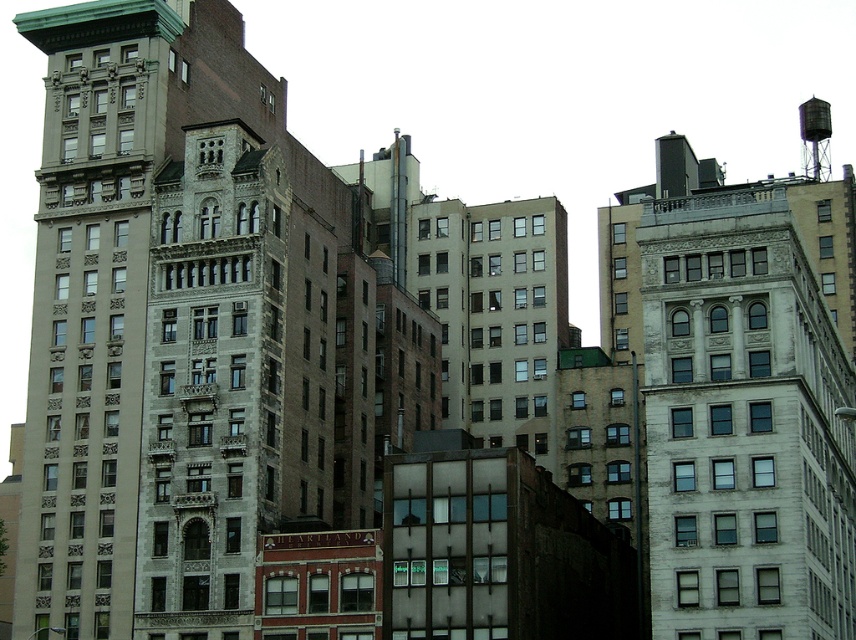
Does point (782, 272) come farther from viewer compared to point (129, 168)?

No, it is not.

The image size is (856, 640). What do you see at coordinates (742, 424) in the screenshot?
I see `white stone building at upper right` at bounding box center [742, 424].

Does point (805, 333) lie in front of point (61, 266)?

Yes, point (805, 333) is in front of point (61, 266).

Identify the location of white stone building at upper right. (742, 424).

Find the location of a particular element. This screenshot has width=856, height=640. gray stone building at center is located at coordinates (211, 381).

Can you confirm if gray stone building at center is shorter than metallic gray water tower at upper right?

Yes.

Consider the image. Who is more forward, (155, 458) or (825, 120)?

Point (155, 458)

You are a GUI agent. You are given a task and a screenshot of the screen. Output one action in this format:
    pyautogui.click(x=<x>, y=<y>)
    Task: Click on the gray stone building at center
    The image size is (856, 640).
    Given the screenshot: What is the action you would take?
    pyautogui.click(x=211, y=381)

Can you confirm if beige stone building at left is smaller than gray stone building at center?

Incorrect, beige stone building at left is not smaller in size than gray stone building at center.

Is beige stone building at left wider than gray stone building at center?

Correct, the width of beige stone building at left exceeds that of gray stone building at center.

The image size is (856, 640). Find the location of `beige stone building at left`. beige stone building at left is located at coordinates (91, 305).

Identify the location of beige stone building at left. The image size is (856, 640). (91, 305).